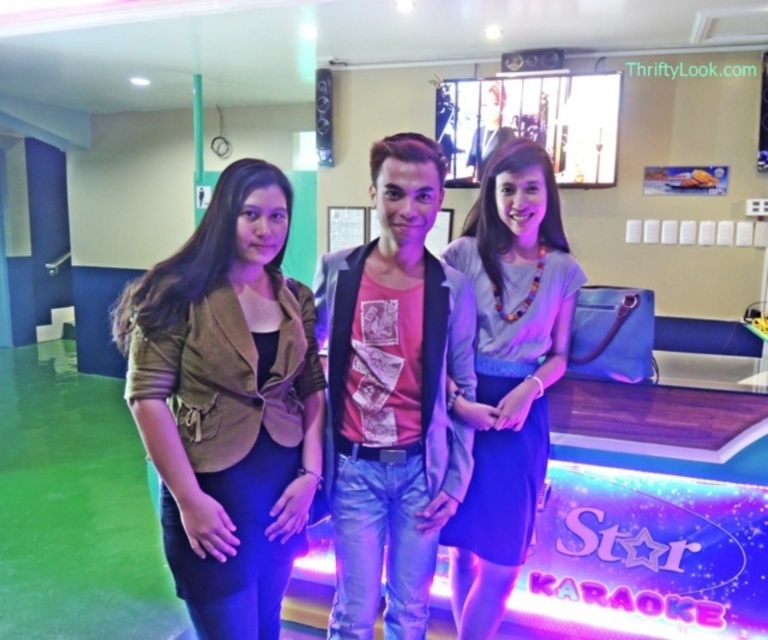
Consider the image. You are standing in a karaoke venue and want to place a small decorative item exactly at the point labeled as point (229, 419). Considering the space around this point, can you confirm if there is enough room to place the item without it being in front of any of the people?

The point (229, 419) is 1.48 meters from the viewer, so there is enough room to place the item there without it being in front of any of the people.

You are standing in a karaoke venue and notice the brown suede blazer at left. Where exactly is it positioned in the image?

The brown suede blazer at left is located at point coordinates of 0.630 on the x axis and 0.298 on the y axis.